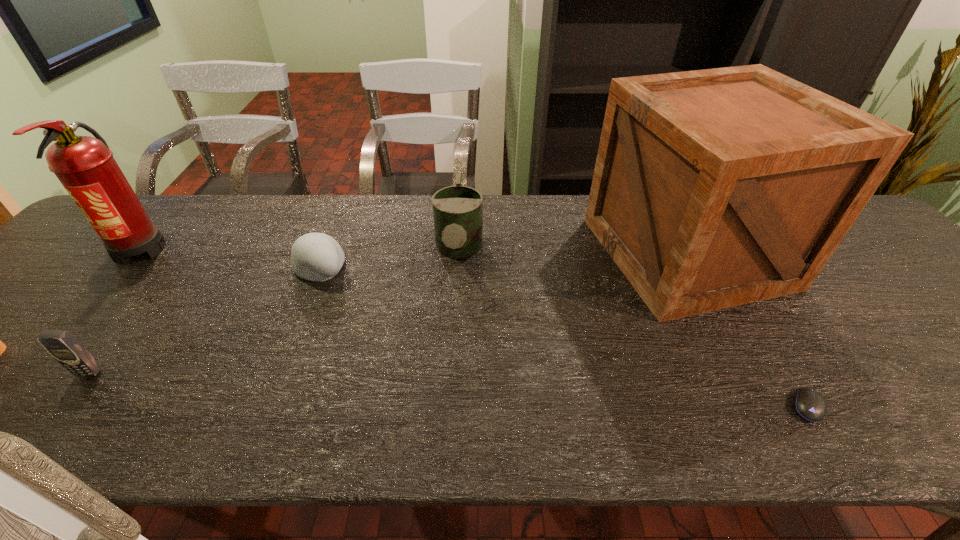
You are a GUI agent. You are given a task and a screenshot of the screen. Output one action in this format:
    pyautogui.click(x=<x>, y=<y>)
    Task: Click on the vacant area situated 0.240m on the left of the box
    This screenshot has width=960, height=540.
    Given the screenshot: What is the action you would take?
    pyautogui.click(x=505, y=253)

Where is `free spot located 0.140m on the front-facing side of the fire extinguisher`? Image resolution: width=960 pixels, height=540 pixels. free spot located 0.140m on the front-facing side of the fire extinguisher is located at coordinates (83, 314).

What are the coordinates of `vacant region located 0.190m with the spout on the watering can` in the screenshot? It's located at (453, 357).

This screenshot has width=960, height=540. Identify the location of free point located on the front face of the cellular telephone. (43, 433).

In order to click on free location located 0.380m on the right of the fifth tallest object in this screenshot , I will do `click(493, 267)`.

Image resolution: width=960 pixels, height=540 pixels. Identify the location of vacant space located on the left of the shortest object. (677, 406).

You are a GUI agent. You are given a task and a screenshot of the screen. Output one action in this format:
    pyautogui.click(x=<x>, y=<y>)
    Task: Click on the box that is at the far edge
    The height and width of the screenshot is (540, 960).
    Given the screenshot: What is the action you would take?
    pyautogui.click(x=714, y=188)

Find the location of a particular element. The image size is (960, 540). fire extinguisher present at the far edge is located at coordinates (85, 166).

Where is `watering can at the far edge`? The height and width of the screenshot is (540, 960). watering can at the far edge is located at coordinates (457, 210).

Image resolution: width=960 pixels, height=540 pixels. What are the coordinates of `object that is at the near edge` in the screenshot? It's located at (809, 404).